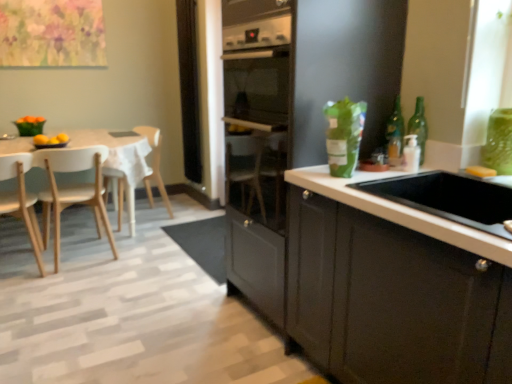
Question: Is point (188, 140) positioned closer to the camera than point (25, 145)?

Choices:
 (A) farther
 (B) closer

Answer: (A)

Question: Choose the correct answer: Is black mesh screen at center inside white wood table at left or outside it?

Choices:
 (A) outside
 (B) inside

Answer: (A)

Question: Considering the real-world distances, which object is closest to the wooden chair at left, the 3th chair viewed from the front?

Choices:
 (A) light wood chair at left, the 2th chair viewed from the front
 (B) light wood chair at left, which is the third chair in back-to-front order
 (C) green glass bottle at upper right, the 2th bottle viewed from the left
 (D) green glass bottle at upper right, positioned as the 1th bottle in left-to-right order
 (E) black mesh screen at center

Answer: (E)

Question: Which object is positioned farthest from the white wood table at left?

Choices:
 (A) wooden chair at left, the 3th chair viewed from the front
 (B) light wood chair at left, arranged as the 1th chair when viewed from the front
 (C) white glossy sink at center right
 (D) light wood chair at left, acting as the 2th chair starting from the back
 (E) black mesh screen at center

Answer: (C)